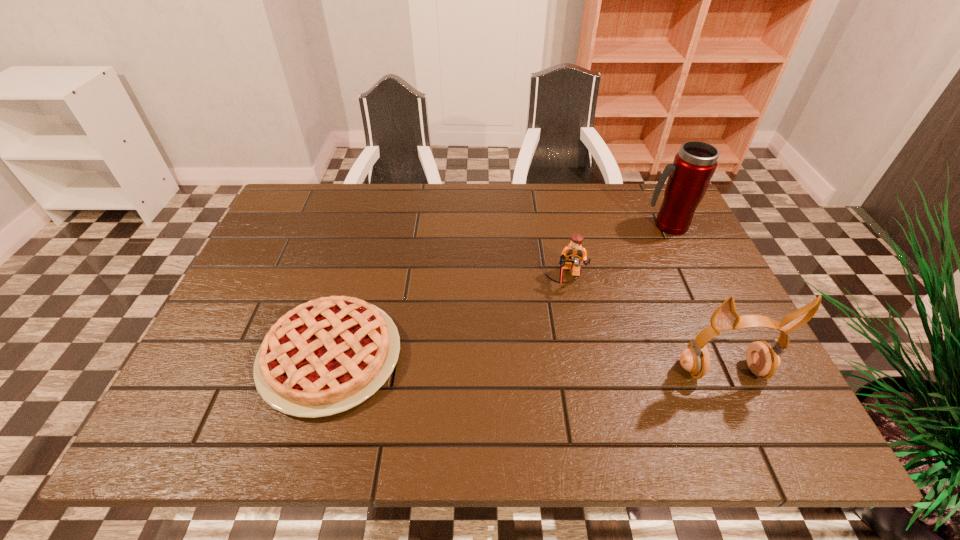
Find the location of `vacant space that satisfies the following two spatial constraints: 1. on the back side of the pie; 2. on the left side of the third tallest object`. vacant space that satisfies the following two spatial constraints: 1. on the back side of the pie; 2. on the left side of the third tallest object is located at coordinates (353, 278).